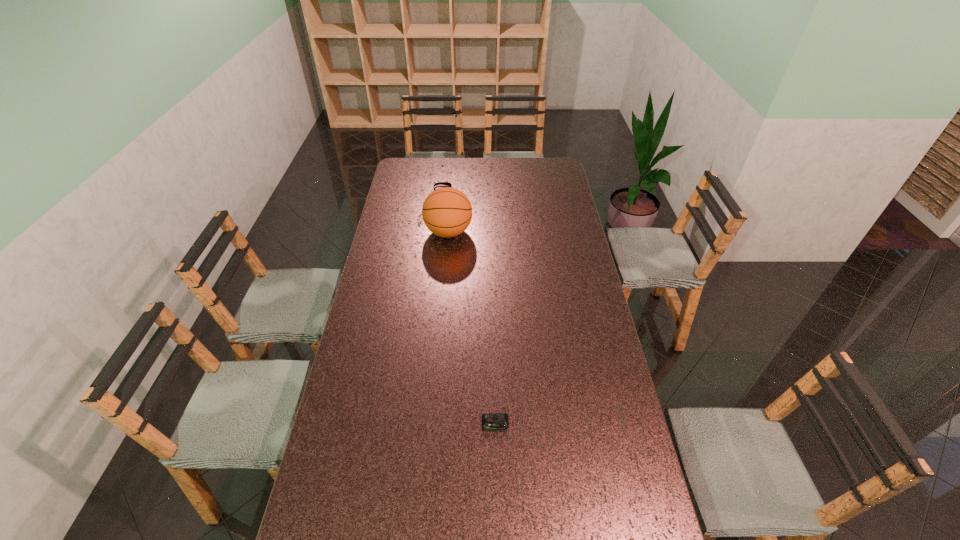
This screenshot has width=960, height=540. What are the coordinates of `free location at the far right corner of the desktop` in the screenshot? It's located at (556, 160).

The width and height of the screenshot is (960, 540). What are the coordinates of `vacant point located between the farthest object and the alarm clock` in the screenshot? It's located at (469, 307).

This screenshot has width=960, height=540. What are the coordinates of `free space between the rightmost object and the basketball` in the screenshot? It's located at (472, 328).

What are the coordinates of `vacant area that lies between the alarm clock and the tallest object` in the screenshot? It's located at (472, 328).

The width and height of the screenshot is (960, 540). What are the coordinates of `empty space between the farthest object and the alarm clock` in the screenshot? It's located at (469, 307).

Identify the location of free area in between the farthest object and the alarm clock. The height and width of the screenshot is (540, 960). (469, 307).

The height and width of the screenshot is (540, 960). What are the coordinates of `empty location between the second nearest object and the alarm clock` in the screenshot? It's located at (472, 328).

Where is `free point between the farthest object and the rightmost object`? free point between the farthest object and the rightmost object is located at coordinates (469, 307).

Locate an element on the screen. This screenshot has height=540, width=960. object that is the closest one to the second nearest object is located at coordinates (439, 183).

Identify which object is the closest to the rightmost object. Please provide its 2D coordinates. Your answer should be formatted as a tuple, i.e. [(x, y)], where the tuple contains the x and y coordinates of a point satisfying the conditions above.

[(447, 212)]